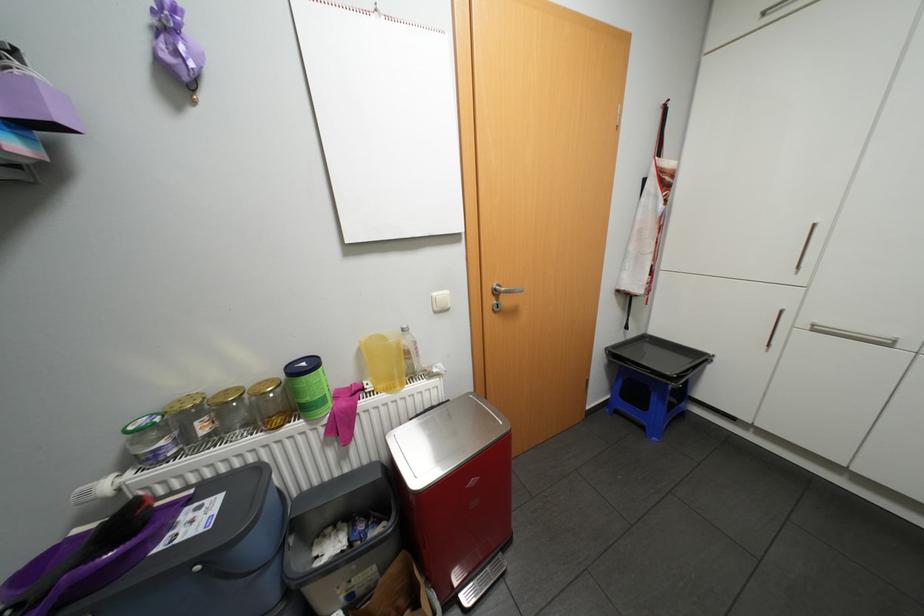
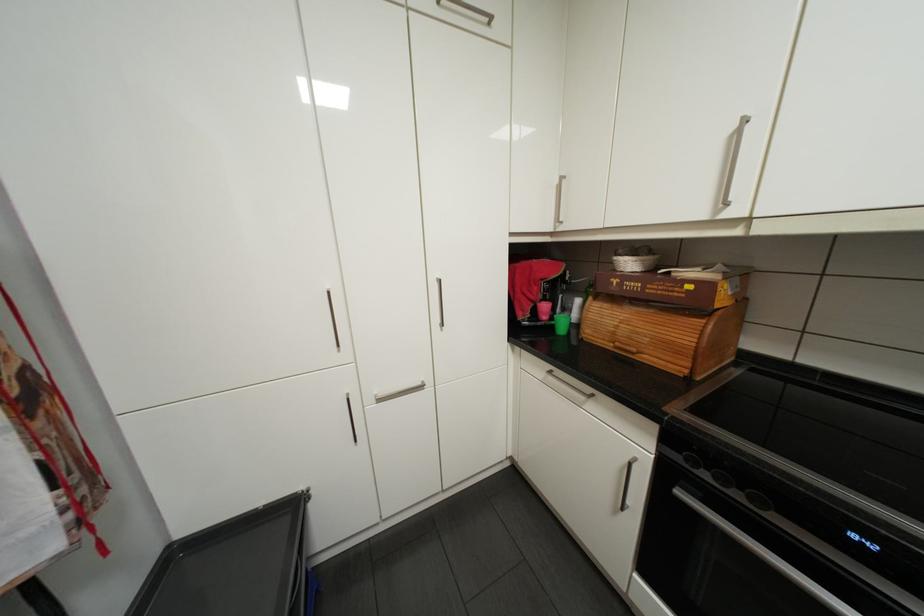
Where in the second image is the point corresponding to pixel 707 357 from the first image?

(300, 507)